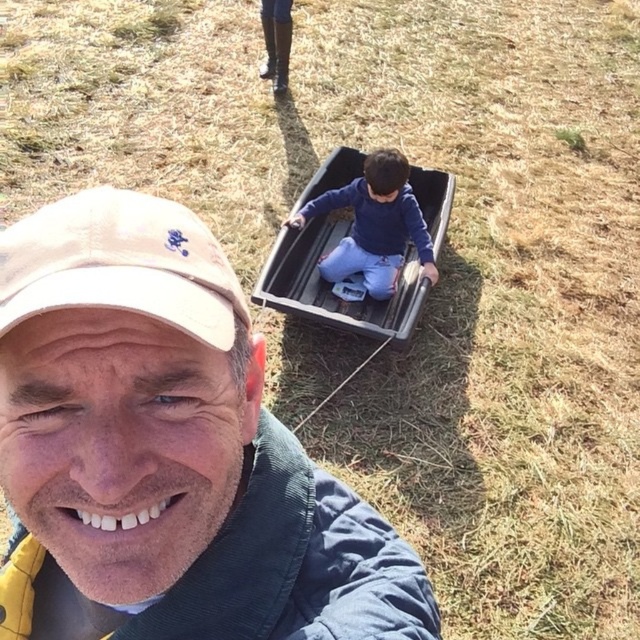
You are standing at the origin of a coordinate system placed at the bottom left corner of the image. A point is marked at coordinate point (166, 451). What object is located at this point?

The point (166, 451) corresponds to the matte khaki cap at upper left.

What is located at the coordinate point (120, 264) in the image?

The beige fabric cap at upper left is located at the coordinate point (120, 264).

You are a photographer trying to capture a photo of both the beige fabric cap at upper left and the black plastic wagon at center. Based on their sizes in the image, which object should you focus on first to ensure both are in frame?

The beige fabric cap at upper left is shorter than the black plastic wagon at center, so you should focus on the black plastic wagon at center first to ensure both are in frame.